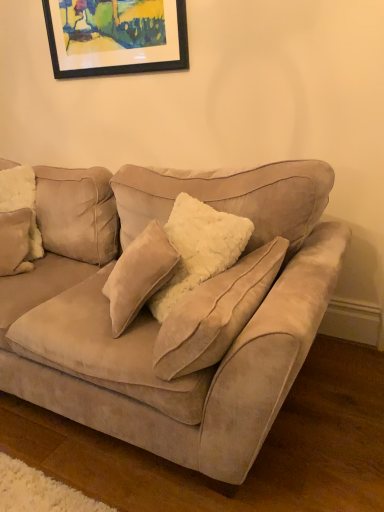
Question: Is suede couch at center shorter than black framed picture at upper center?

Choices:
 (A) no
 (B) yes

Answer: (A)

Question: Is suede couch at center smaller than black framed picture at upper center?

Choices:
 (A) no
 (B) yes

Answer: (A)

Question: Is suede couch at center thinner than black framed picture at upper center?

Choices:
 (A) no
 (B) yes

Answer: (A)

Question: Considering the relative sizes of suede couch at center and black framed picture at upper center in the image provided, is suede couch at center taller than black framed picture at upper center?

Choices:
 (A) no
 (B) yes

Answer: (B)

Question: From the image's perspective, would you say suede couch at center is shown under black framed picture at upper center?

Choices:
 (A) no
 (B) yes

Answer: (B)

Question: Considering their positions, is black framed picture at upper center located in front of or behind fuzzy beige pillow at left?

Choices:
 (A) front
 (B) behind

Answer: (B)

Question: From the image's perspective, is black framed picture at upper center above or below fuzzy beige pillow at left?

Choices:
 (A) below
 (B) above

Answer: (B)

Question: Is black framed picture at upper center inside or outside of fuzzy beige pillow at left?

Choices:
 (A) inside
 (B) outside

Answer: (B)

Question: Considering the positions of point tap(74, 62) and point tap(29, 245), is point tap(74, 62) closer or farther from the camera than point tap(29, 245)?

Choices:
 (A) farther
 (B) closer

Answer: (A)

Question: In terms of width, does suede couch at center look wider or thinner when compared to black framed picture at upper center?

Choices:
 (A) thin
 (B) wide

Answer: (B)

Question: Is suede couch at center inside or outside of black framed picture at upper center?

Choices:
 (A) outside
 (B) inside

Answer: (A)

Question: From the image's perspective, is suede couch at center above or below black framed picture at upper center?

Choices:
 (A) above
 (B) below

Answer: (B)

Question: Considering the positions of point (57, 359) and point (99, 12), is point (57, 359) closer or farther from the camera than point (99, 12)?

Choices:
 (A) farther
 (B) closer

Answer: (B)

Question: From their relative heights in the image, would you say fuzzy beige pillow at left is taller or shorter than black framed picture at upper center?

Choices:
 (A) short
 (B) tall

Answer: (B)

Question: Based on their positions, is fuzzy beige pillow at left located to the left or right of black framed picture at upper center?

Choices:
 (A) right
 (B) left

Answer: (B)